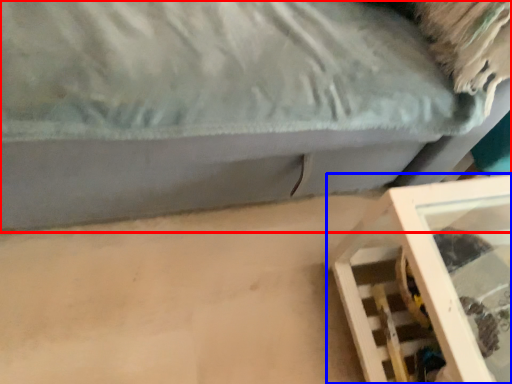
Question: Which point is closer to the camera, furniture (highlighted by a red box) or furniture (highlighted by a blue box)?

Choices:
 (A) furniture
 (B) furniture

Answer: (A)